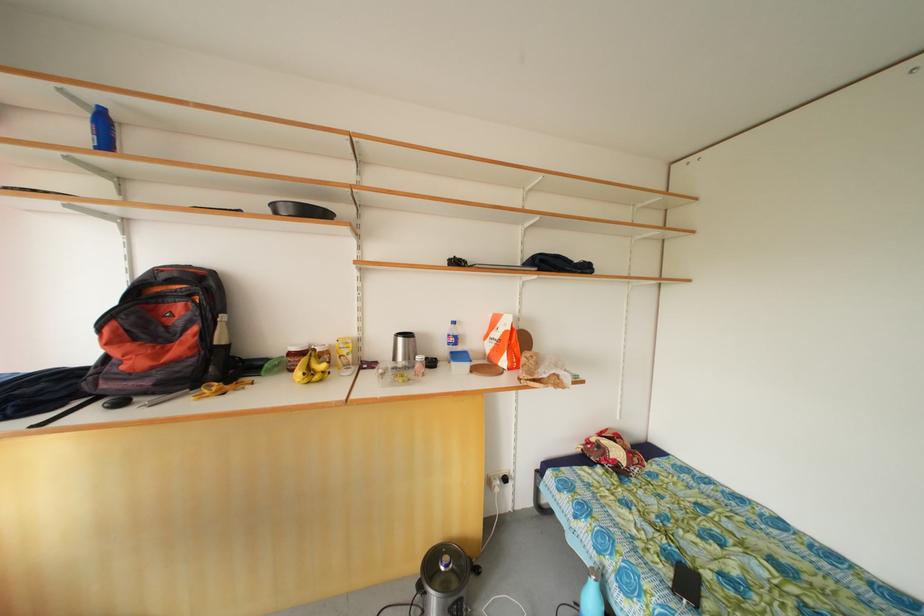
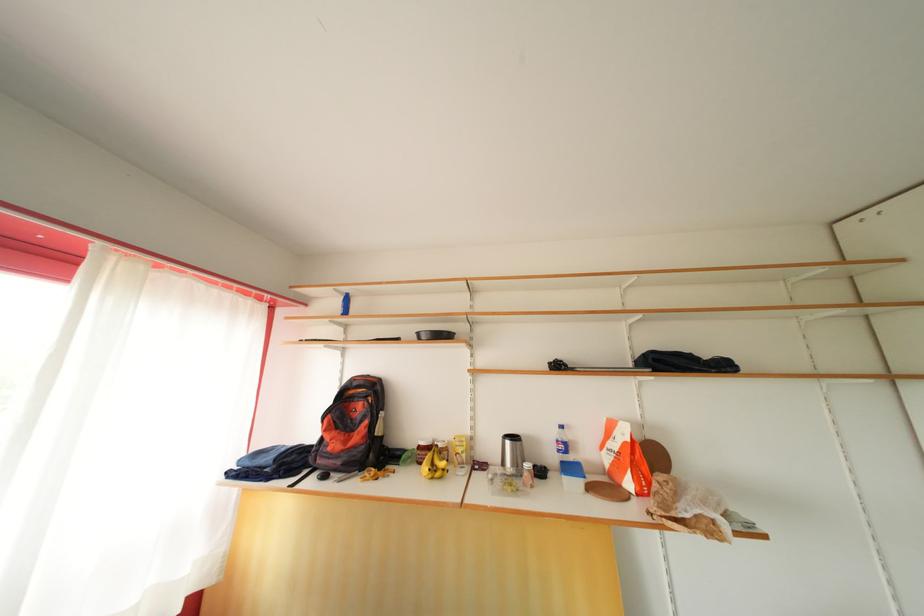
In the second image, find the point that corresponds to (x=311, y=365) in the first image.

(436, 461)